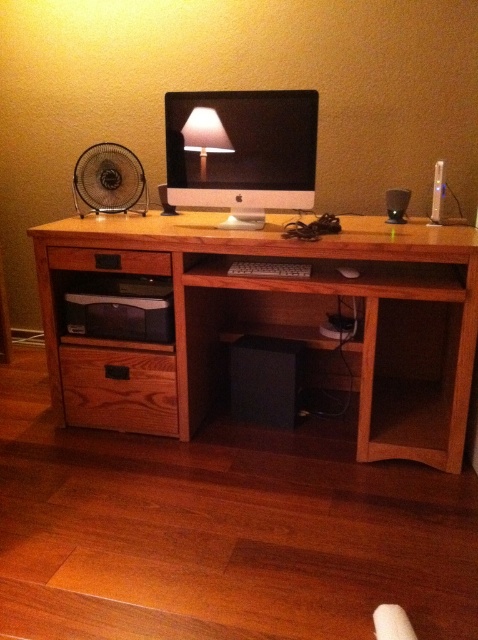
From the picture: Between satin white monitor at center and black plastic fan at left, which one has less height?

black plastic fan at left is shorter.

This screenshot has height=640, width=478. What do you see at coordinates (241, 150) in the screenshot? I see `satin white monitor at center` at bounding box center [241, 150].

Image resolution: width=478 pixels, height=640 pixels. What are the coordinates of `satin white monitor at center` in the screenshot? It's located at (241, 150).

Is pine wood drawer at lower left to the left of black plastic fan at left from the viewer's perspective?

In fact, pine wood drawer at lower left is to the right of black plastic fan at left.

You are a GUI agent. You are given a task and a screenshot of the screen. Output one action in this format:
    pyautogui.click(x=<x>, y=<y>)
    Task: Click on the pine wood drawer at lower left
    The height and width of the screenshot is (640, 478).
    Given the screenshot: What is the action you would take?
    pyautogui.click(x=119, y=388)

Find the location of a particular element. This screenshot has height=640, width=478. pine wood drawer at lower left is located at coordinates (119, 388).

Can you confirm if brown wood drawer at lower left is shorter than matte white lampshade at upper center?

Correct, brown wood drawer at lower left is not as tall as matte white lampshade at upper center.

Does point (63, 268) come in front of point (215, 140)?

No, (63, 268) is behind (215, 140).

Describe the element at coordinates (109, 260) in the screenshot. The height and width of the screenshot is (640, 478). I see `brown wood drawer at lower left` at that location.

Identify the location of brown wood drawer at lower left. The height and width of the screenshot is (640, 478). (109, 260).